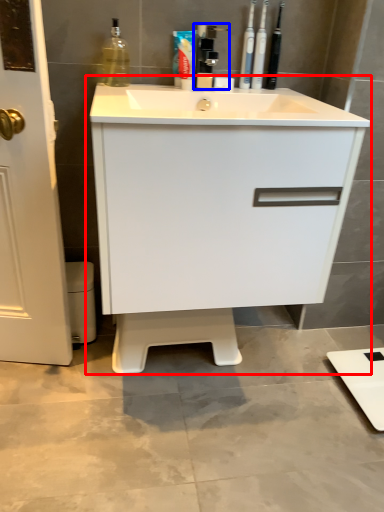
Question: Which object appears farthest to the camera in this image, bathroom cabinet (highlighted by a red box) or faucet (highlighted by a blue box)?

Choices:
 (A) bathroom cabinet
 (B) faucet

Answer: (B)